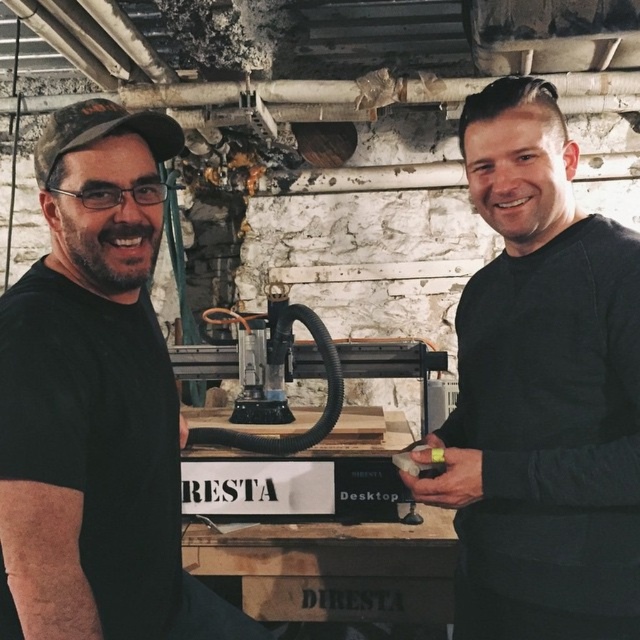
Question: Which point appears closest to the camera in this image?

Choices:
 (A) (28, 424)
 (B) (579, 524)

Answer: (A)

Question: Does black matte shirt at center have a smaller size compared to black matte t-shirt at left?

Choices:
 (A) no
 (B) yes

Answer: (B)

Question: Is black matte shirt at center thinner than black matte t-shirt at left?

Choices:
 (A) yes
 (B) no

Answer: (B)

Question: Does black matte shirt at center have a greater width compared to black matte t-shirt at left?

Choices:
 (A) no
 (B) yes

Answer: (B)